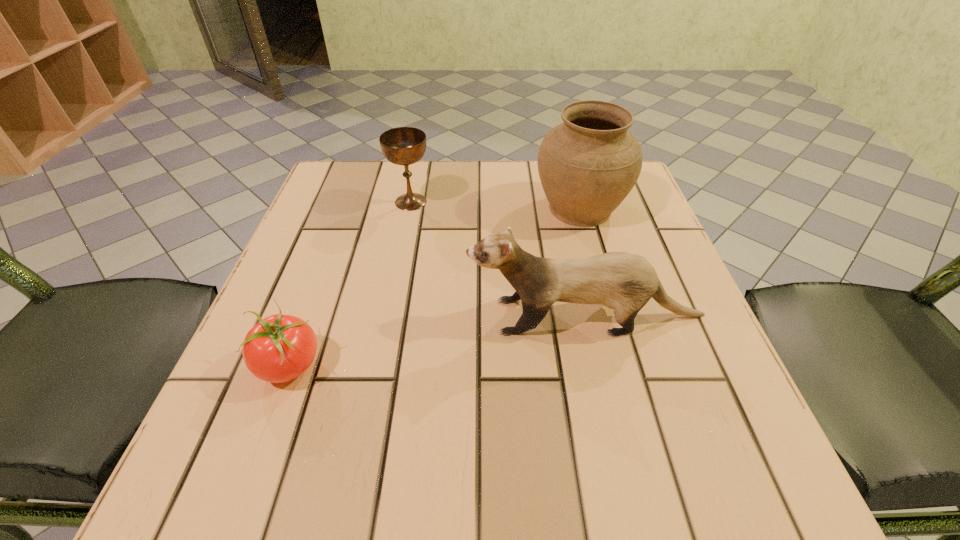
In order to click on free space located 0.130m on the right of the leftmost object in this screenshot , I will do `click(406, 364)`.

Where is `urn located in the far edge section of the desktop`? This screenshot has height=540, width=960. urn located in the far edge section of the desktop is located at coordinates (587, 165).

At what (x,y) coordinates should I click in order to perform the action: click on chalice located in the far edge section of the desktop. Please return your answer as a coordinate pair (x, y). Image resolution: width=960 pixels, height=540 pixels. Looking at the image, I should click on (404, 146).

Find the location of a particular element. object located at the left edge is located at coordinates (279, 348).

Find the location of a particular element. urn present at the right edge is located at coordinates (587, 165).

What are the coordinates of `ferret located in the right edge section of the desktop` in the screenshot? It's located at coord(625,282).

Locate an element on the screen. The image size is (960, 540). object that is at the far right corner is located at coordinates (587, 165).

Find the location of a particular element. vacant space at the far edge is located at coordinates (491, 159).

This screenshot has width=960, height=540. In the image, there is a desktop. What are the coordinates of `vacant space at the near edge` in the screenshot? It's located at (631, 499).

In the image, there is a desktop. At what (x,y) coordinates should I click in order to perform the action: click on vacant space at the left edge. Please return your answer as a coordinate pair (x, y). This screenshot has height=540, width=960. Looking at the image, I should click on (275, 293).